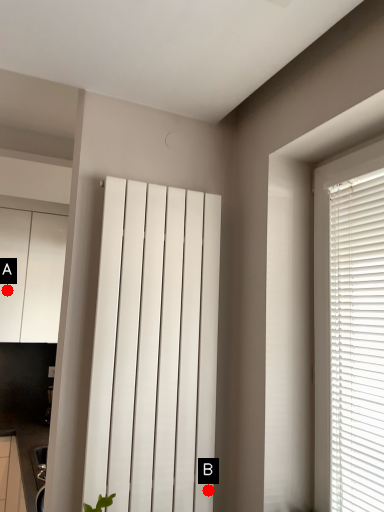
Question: Two points are circled on the image, labeled by A and B beside each circle. Which of the following is the farthest from the observer?

Choices:
 (A) A is further
 (B) B is further

Answer: (A)